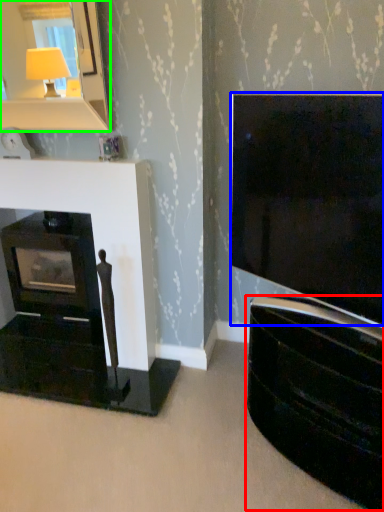
Question: Which object is the closest to the tv cabinet (highlighted by a red box)? Choose among these: television (highlighted by a blue box) or mirror (highlighted by a green box).

Choices:
 (A) television
 (B) mirror

Answer: (A)